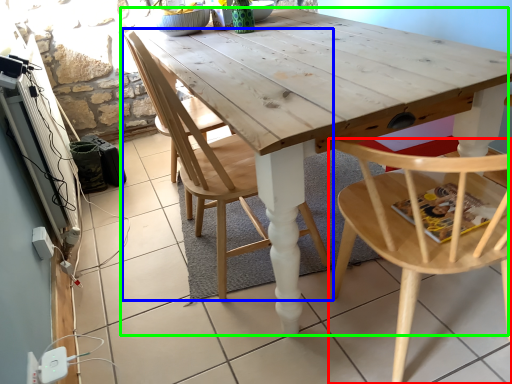
Question: Which object is positioned closest to chair (highlighted by a red box)? Select from chair (highlighted by a blue box) and table (highlighted by a green box).

Choices:
 (A) chair
 (B) table

Answer: (B)